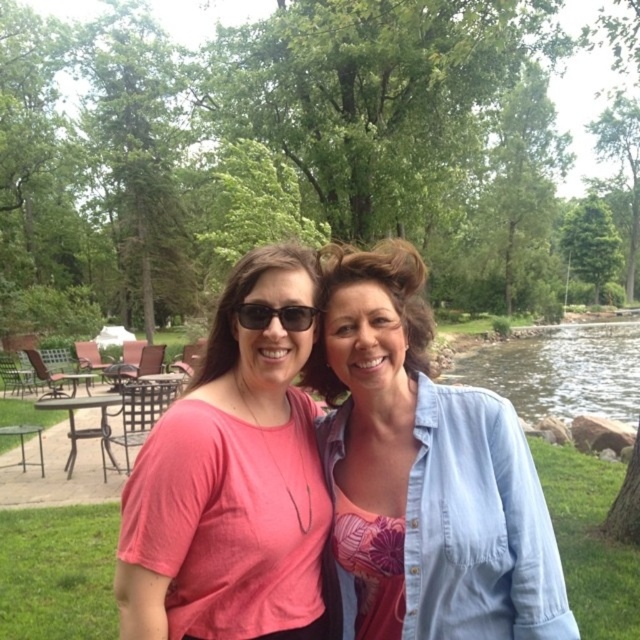
Does light blue denim shirt at center have a greater height compared to brown metal picnic table at lower left?

Indeed, light blue denim shirt at center has a greater height compared to brown metal picnic table at lower left.

Between point (534, 550) and point (109, 449), which one is positioned behind?

The point (109, 449) is behind.

In order to click on light blue denim shirt at center in this screenshot , I will do `click(422, 474)`.

Does brown metal picnic table at lower left appear over matte black sunglasses at center?

Actually, brown metal picnic table at lower left is below matte black sunglasses at center.

Can you confirm if brown metal picnic table at lower left is positioned below matte black sunglasses at center?

Correct, brown metal picnic table at lower left is located below matte black sunglasses at center.

Is point (68, 452) positioned after point (253, 310)?

Yes, point (68, 452) is behind point (253, 310).

You are a GUI agent. You are given a task and a screenshot of the screen. Output one action in this format:
    pyautogui.click(x=<x>, y=<y>)
    Task: Click on the brown metal picnic table at lower left
    This screenshot has height=640, width=640.
    Given the screenshot: What is the action you would take?
    pyautogui.click(x=84, y=428)

Which of these two, pink fabric shirt at center or clear water at right, stands taller?

With more height is clear water at right.

Is point (284, 408) farther from viewer compared to point (611, 356)?

No, (284, 408) is closer to viewer.

Who is more distant from viewer, (230,634) or (506,353)?

The point (506,353) is behind.

This screenshot has width=640, height=640. Identify the location of pink fabric shirt at center. (230, 481).